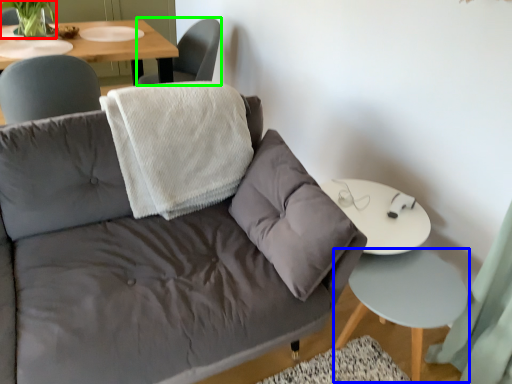
Question: Which object is positioned farthest from plant (highlighted by a red box)? Select from side table (highlighted by a blue box) and chair (highlighted by a green box).

Choices:
 (A) side table
 (B) chair

Answer: (A)